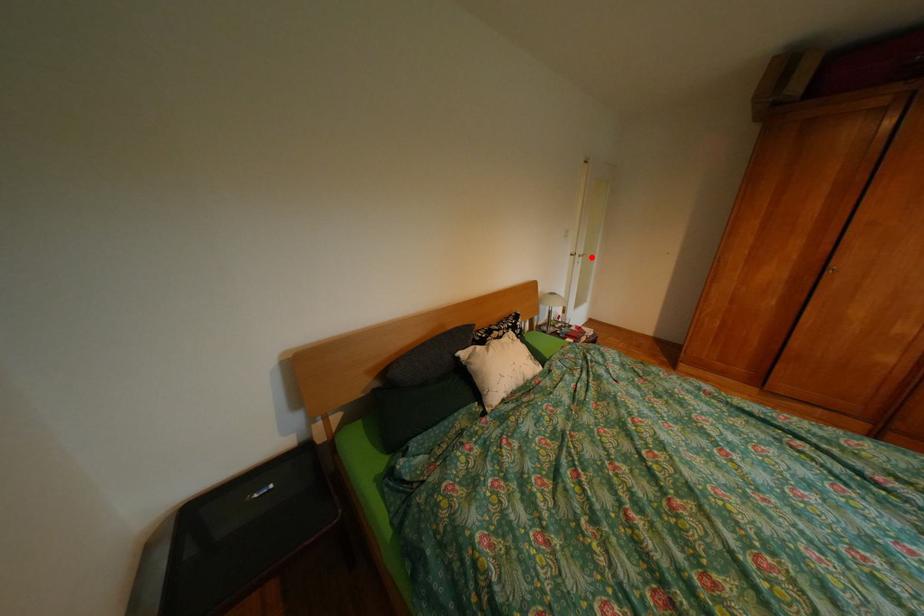
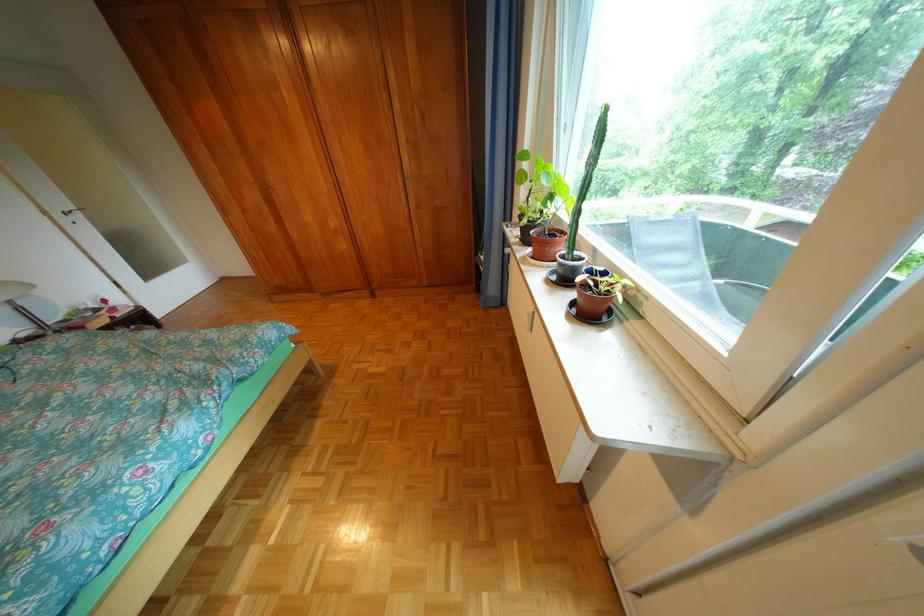
Locate, in the second image, the point that corresponds to the highlighted location in the first image.

(73, 216)